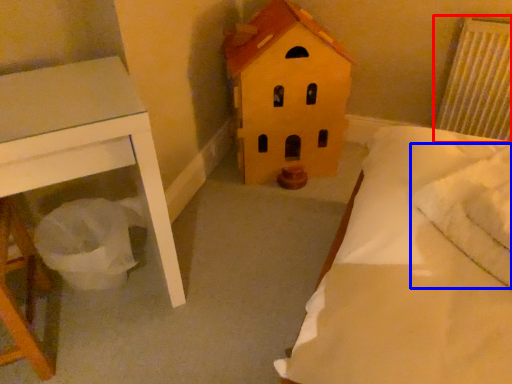
Question: Among these objects, which one is farthest to the camera, radiator (highlighted by a red box) or pillow (highlighted by a blue box)?

Choices:
 (A) radiator
 (B) pillow

Answer: (A)